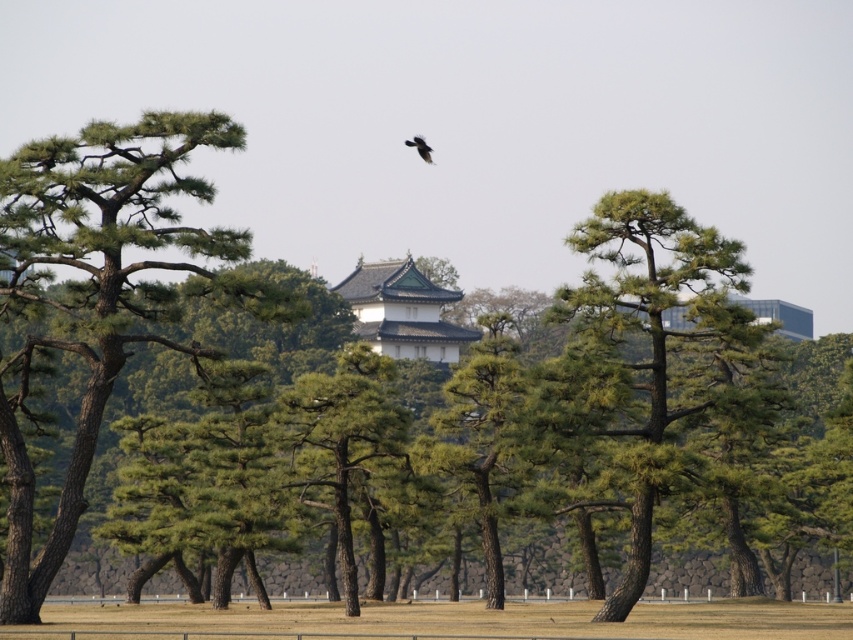
Question: Which point is farther from the camera taking this photo?

Choices:
 (A) (148, 234)
 (B) (415, 147)
 (C) (606, 381)

Answer: (B)

Question: Which of these objects is positioned closest to the green matte tree at left?

Choices:
 (A) black matte bird at upper center
 (B) green matte tree at center

Answer: (B)

Question: Observing the image, what is the correct spatial positioning of green matte tree at left in reference to black matte bird at upper center?

Choices:
 (A) right
 (B) left

Answer: (B)

Question: Is green matte tree at left to the right of green matte tree at center from the viewer's perspective?

Choices:
 (A) yes
 (B) no

Answer: (B)

Question: Is green matte tree at left bigger than green matte tree at center?

Choices:
 (A) no
 (B) yes

Answer: (B)

Question: Which point appears closest to the camera in this image?

Choices:
 (A) (4, 573)
 (B) (421, 147)
 (C) (601, 346)

Answer: (A)